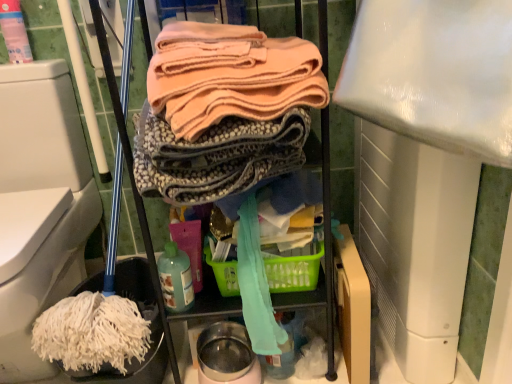
Question: From a real-world perspective, is green plastic basket at center physically located above or below translucent plastic bottle at lower center?

Choices:
 (A) above
 (B) below

Answer: (B)

Question: Choose the correct answer: Is green plastic basket at center inside translucent plastic bottle at lower center or outside it?

Choices:
 (A) outside
 (B) inside

Answer: (A)

Question: Which object is the farthest from the green plastic basket at center?

Choices:
 (A) translucent plastic bottle at lower center
 (B) white fabric mop head at lower left
 (C) pink plastic spray bottle at upper left

Answer: (C)

Question: Estimate the real-world distances between objects in this image. Which object is farther from the pink plastic spray bottle at upper left?

Choices:
 (A) green plastic basket at center
 (B) white fabric mop head at lower left
 (C) translucent plastic bottle at lower center

Answer: (A)